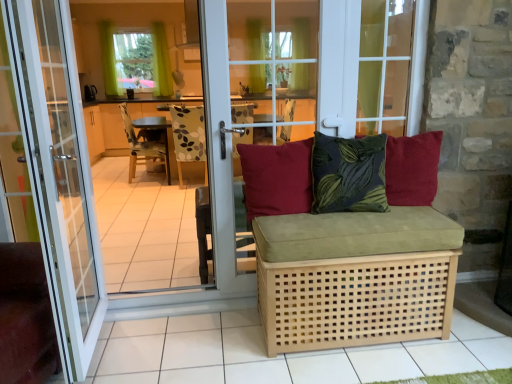
Locate an element on the screen. vacant space in between white glass door at center and light brown woven studio couch at center is located at coordinates (210, 346).